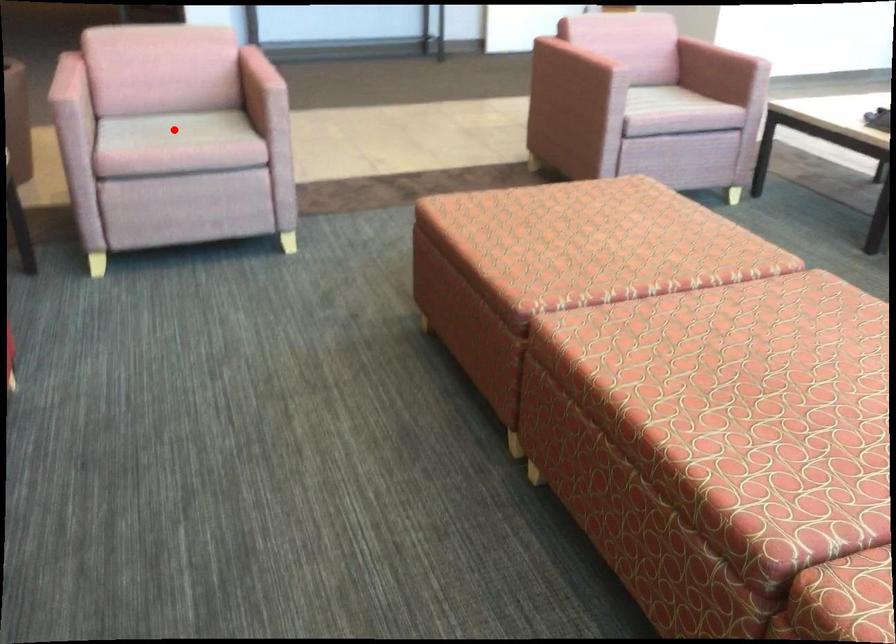
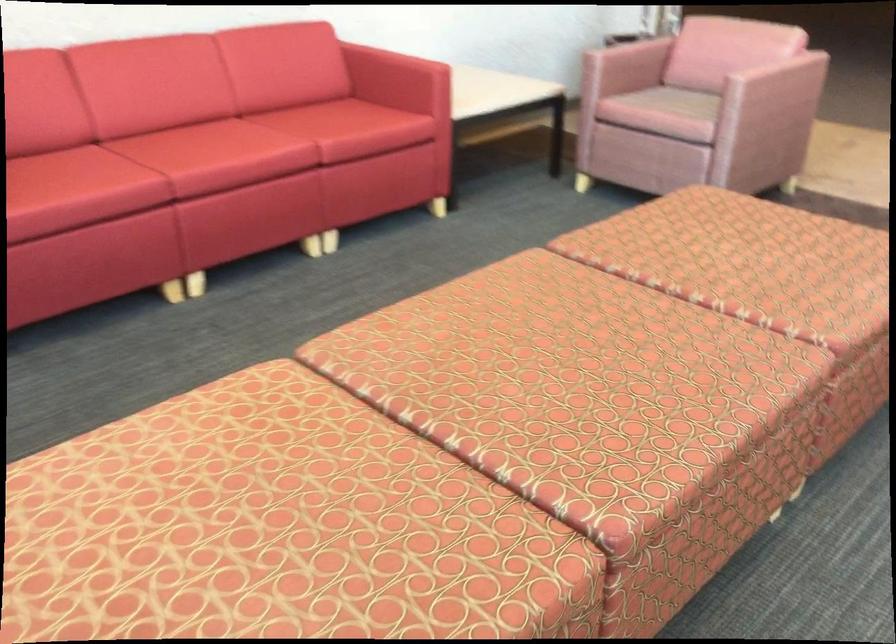
Question: I am providing you with two images of the same scene from different viewpoints. In image1, a red point is highlighted. Considering the same 3D point in image2, which of the following is correct?

Choices:
 (A) It is closer
 (B) It is farther

Answer: (B)